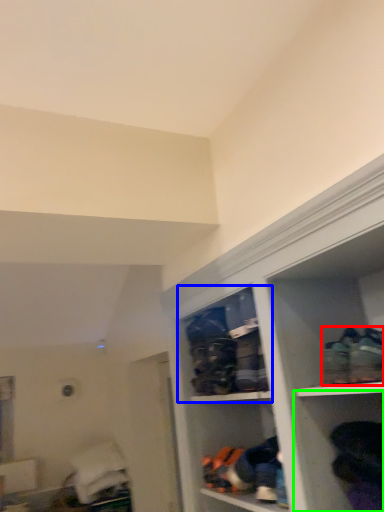
Question: Which is farther away from footwear (highlighted by a red box)? cabinet (highlighted by a blue box) or shelf (highlighted by a green box)?

Choices:
 (A) cabinet
 (B) shelf

Answer: (A)